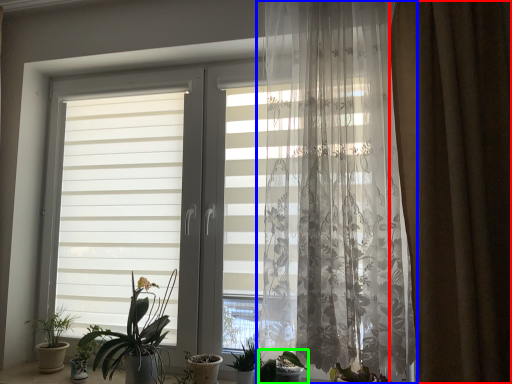
Question: Which object is the farthest from curtain (highlighted by a red box)? Choose among these: curtain (highlighted by a blue box) or houseplant (highlighted by a green box).

Choices:
 (A) curtain
 (B) houseplant

Answer: (B)